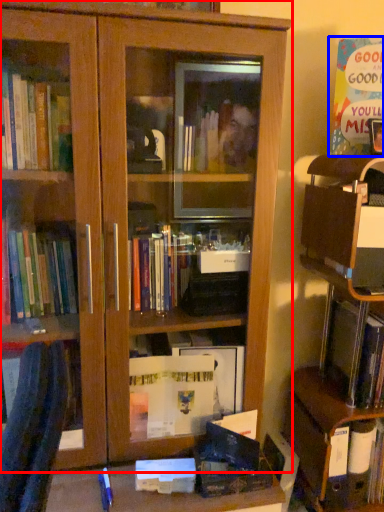
Question: Which object is further to the camera taking this photo, bookcase (highlighted by a red box) or paperback book (highlighted by a blue box)?

Choices:
 (A) bookcase
 (B) paperback book

Answer: (B)